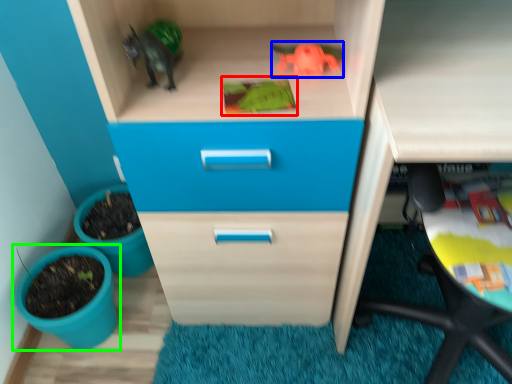
Question: Considering the real-world distances, which object is farthest from toy (highlighted by a red box)? toy (highlighted by a blue box) or flowerpot (highlighted by a green box)?

Choices:
 (A) toy
 (B) flowerpot

Answer: (B)